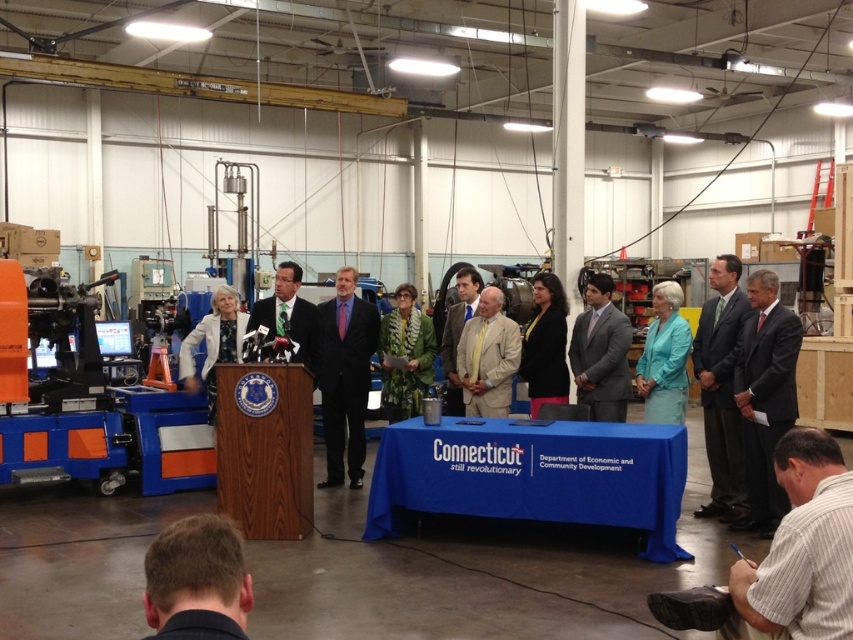
You are attending a formal event in an industrial facility and see a person with brown hair at lower left and a person wearing a green textured coat at center. From the perspective of someone standing at the entrance, which person is positioned more to the left side of the scene?

The brown hair at lower left is positioned to the left of the green textured coat at center, so the person with brown hair at lower left is more to the left side of the scene.

You are a photographer at this event and need to fit both the dark gray suit at center and the green fabric suit at center into a single frame. Which suit is narrower so you can position it closer to the edge of the frame?

The dark gray suit at center is thinner than the green fabric suit at center, so you can position the dark gray suit at center closer to the edge of the frame to ensure both fit within the photo.